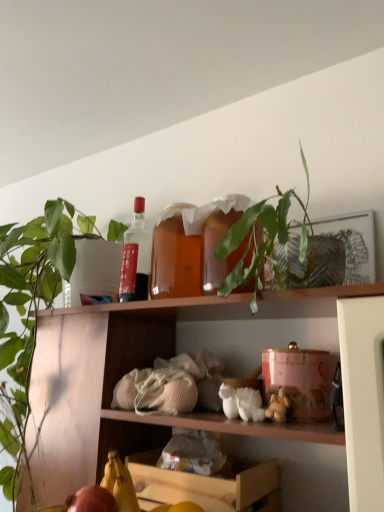
Question: In terms of width, does yellow matte banana at lower left look wider or thinner when compared to green leafy plant at upper center?

Choices:
 (A) thin
 (B) wide

Answer: (A)

Question: In terms of height, does yellow matte banana at lower left look taller or shorter compared to green leafy plant at upper center?

Choices:
 (A) short
 (B) tall

Answer: (A)

Question: Estimate the real-world distances between objects in this image. Which object is closer to the matte red apple at lower left?

Choices:
 (A) green matte plant at upper left
 (B) yellow matte banana at lower left
 (C) wooden crate at lower center
 (D) green leafy plant at upper center
 (E) matte glass bottle at upper center

Answer: (B)

Question: Which is farther from the wooden crate at lower center?

Choices:
 (A) green leafy plant at upper center
 (B) yellow matte banana at lower left
 (C) matte red apple at lower left
 (D) green matte plant at upper left
 (E) matte glass bottle at upper center

Answer: (E)